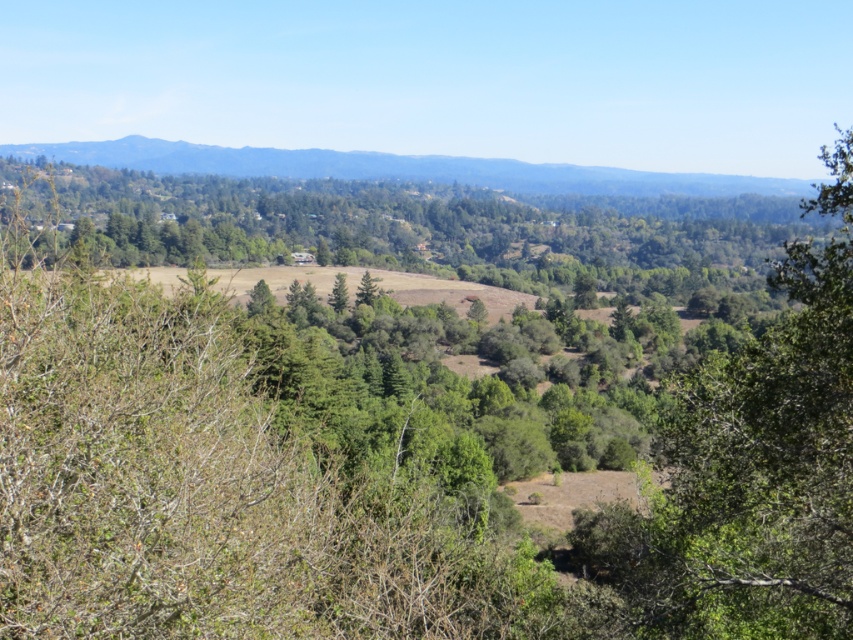
You are standing at the point marked by the coordinates point (410, 228) in the image. Looking around, you notice a green leafy tree at center. Which direction should you walk to reach the leafless branches on the left side of the image?

Since the point (410, 228) represents the green leafy tree at center, you should walk to the left to reach the leafless branches on the left side of the image.

You are standing in the middle of the landscape and want to take a photo of the green leafy tree at center and the green forested mountain at upper center. Which object should you point your camera towards first to capture both in the same frame?

You should point your camera towards the green forested mountain at upper center first because the green leafy tree at center is located below it, so adjusting the angle to include both would require framing from the upper part downwards.

You are standing in the middle of the landscape and want to take a photo of both the green leafy tree at center and the green forested mountain at upper center. Which object should you adjust your camera to focus on first if you want to capture both in the same frame?

The green leafy tree at center is to the right of the green forested mountain at upper center, so you should focus on the green forested mountain at upper center first to ensure both are in the frame.